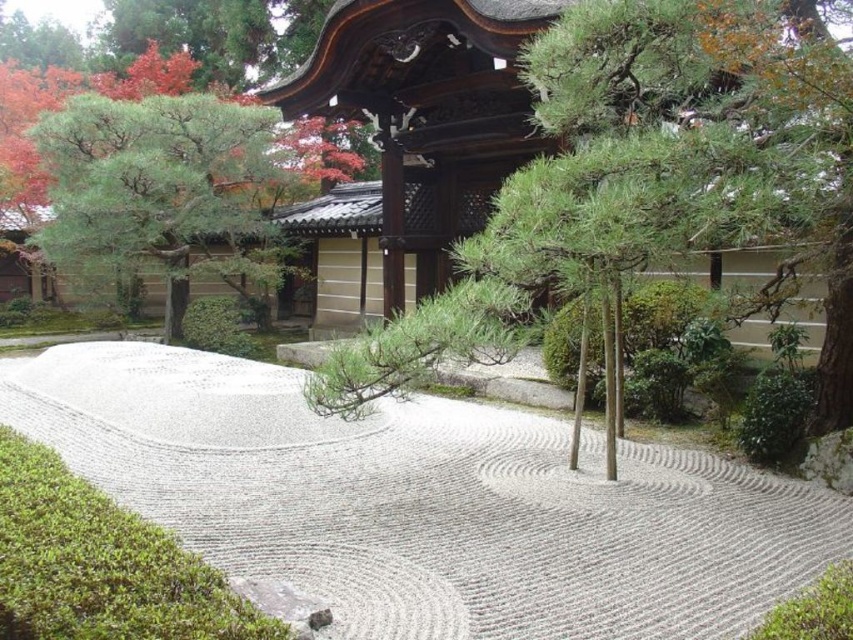
You are a gardener planning to place a 1.2 meter wide decorative stone on the white gravel path at center. Given the green textured pine tree at center is nearby, will the stone fit without encroaching on the tree?

The white gravel path at center is wider than the green textured pine tree at center, so placing a 1.2 meter wide stone there should be possible without affecting the tree, provided the path has sufficient width. However, exact placement would depend on the path dimensions.

You are a visitor standing at the entrance of the Japanese garden. You want to find the white gravel path at center. Based on the garden layout described, where should you look to locate it?

The white gravel path at center is located at point coordinates approximately 0.784 on the x axis and 0.501 on the y axis.

You are standing in the Japanese garden and want to take a photo of the white gravel path at center and the green textured pine tree at center. Which object should you focus on first to ensure both are in sharp focus?

You should focus on the white gravel path at center first because it is closer to the viewer than the green textured pine tree at center, ensuring both will be in focus when using depth of field properly.